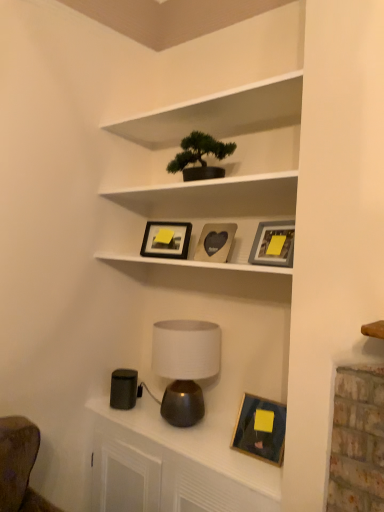
Question: Is metallic lamp at lower center not within matte gray picture frame at upper center, the 3th picture frame when ordered from top to bottom?

Choices:
 (A) yes
 (B) no

Answer: (A)

Question: Is metallic lamp at lower center oriented towards matte gray picture frame at upper center, the second picture frame from the bottom?

Choices:
 (A) no
 (B) yes

Answer: (A)

Question: Considering the relative sizes of metallic lamp at lower center and matte gray picture frame at upper center, the 3th picture frame when ordered from top to bottom, in the image provided, is metallic lamp at lower center shorter than matte gray picture frame at upper center, the 3th picture frame when ordered from top to bottom,?

Choices:
 (A) no
 (B) yes

Answer: (A)

Question: Considering the relative sizes of metallic lamp at lower center and matte gray picture frame at upper center, the 3th picture frame when ordered from top to bottom, in the image provided, is metallic lamp at lower center smaller than matte gray picture frame at upper center, the 3th picture frame when ordered from top to bottom,?

Choices:
 (A) no
 (B) yes

Answer: (A)

Question: Does metallic lamp at lower center have a larger size compared to matte gray picture frame at upper center, the 3th picture frame when ordered from top to bottom?

Choices:
 (A) no
 (B) yes

Answer: (B)

Question: Is green matte bonsai tree at upper center wider or thinner than matte gray picture frame at upper center, the second picture frame from the bottom?

Choices:
 (A) wide
 (B) thin

Answer: (A)

Question: From the image's perspective, is green matte bonsai tree at upper center positioned above or below matte gray picture frame at upper center, the 3th picture frame when ordered from top to bottom?

Choices:
 (A) above
 (B) below

Answer: (A)

Question: Looking at the image, does green matte bonsai tree at upper center seem bigger or smaller compared to matte gray picture frame at upper center, the second picture frame from the bottom?

Choices:
 (A) big
 (B) small

Answer: (A)

Question: In terms of height, does green matte bonsai tree at upper center look taller or shorter compared to matte gray picture frame at upper center, the 3th picture frame when ordered from top to bottom?

Choices:
 (A) short
 (B) tall

Answer: (B)

Question: Looking at their shapes, would you say green matte bonsai tree at upper center is wider or thinner than matte brown table lamp at center?

Choices:
 (A) wide
 (B) thin

Answer: (B)

Question: Which is correct: green matte bonsai tree at upper center is inside matte brown table lamp at center, or outside of it?

Choices:
 (A) inside
 (B) outside

Answer: (B)

Question: Is green matte bonsai tree at upper center bigger or smaller than matte brown table lamp at center?

Choices:
 (A) small
 (B) big

Answer: (A)

Question: From the image's perspective, is green matte bonsai tree at upper center positioned above or below matte brown table lamp at center?

Choices:
 (A) above
 (B) below

Answer: (A)

Question: In terms of width, does green matte bonsai tree at upper center look wider or thinner when compared to metallic lamp at lower center?

Choices:
 (A) thin
 (B) wide

Answer: (A)

Question: In the image, is green matte bonsai tree at upper center positioned in front of or behind metallic lamp at lower center?

Choices:
 (A) behind
 (B) front

Answer: (A)